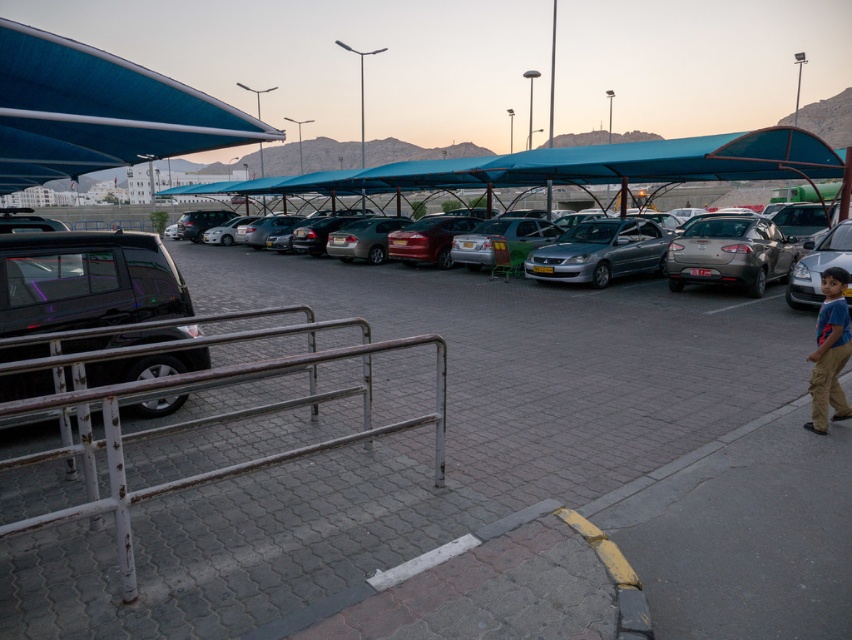
You are standing at the center of the parking area and want to locate the metallic black car at left. According to the coordinates provided, in which direction should you look to find it?

The metallic black car at left is located at coordinates 0.755 on the x axis and 0.580 on the y axis. Since the x coordinate is greater than 0.5, it means the car is positioned to the right side of the parking area. Therefore, you should look to your right to find the metallic black car at left.

You are standing at the entrance of the parking area and want to reach the rusty metal rail at lower left. According to the coordinates provided, where exactly should you look to find it?

The rusty metal rail at lower left is located at point coordinates (199, 422), so you should look towards those coordinates to find it.